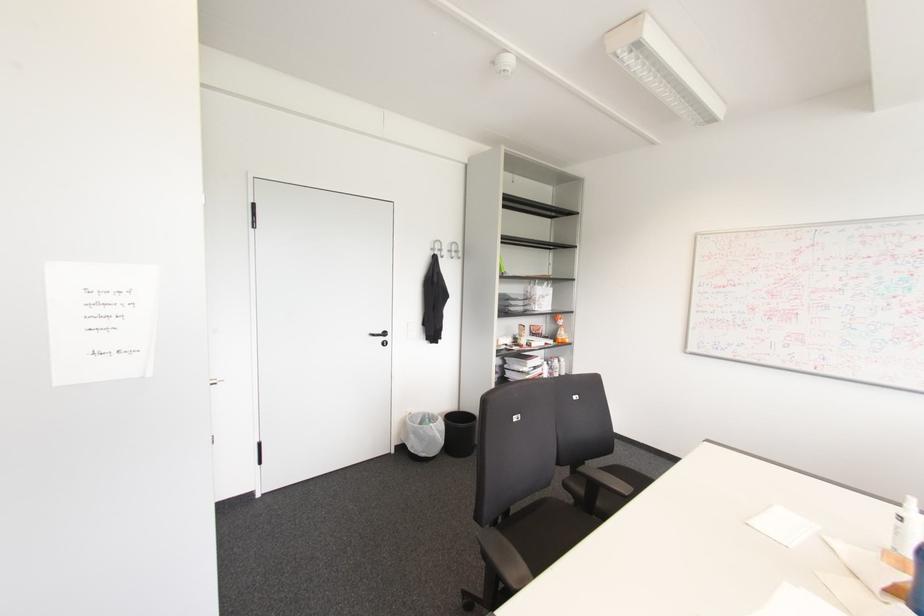
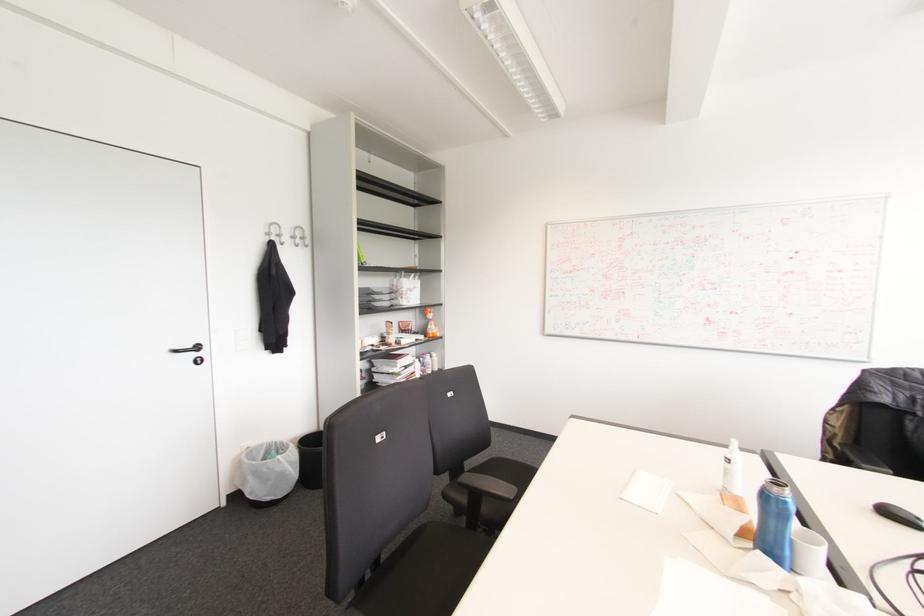
The point at (456,251) is marked in the first image. Where is the corresponding point in the second image?

(301, 238)